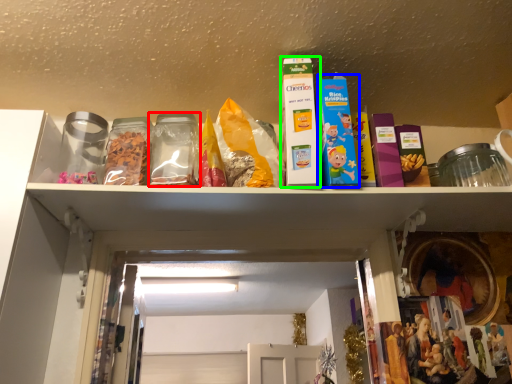
Question: Based on their relative distances, which object is farther from glass jar (highlighted by a red box)? Choose from product (highlighted by a blue box) and product (highlighted by a green box).

Choices:
 (A) product
 (B) product

Answer: (A)